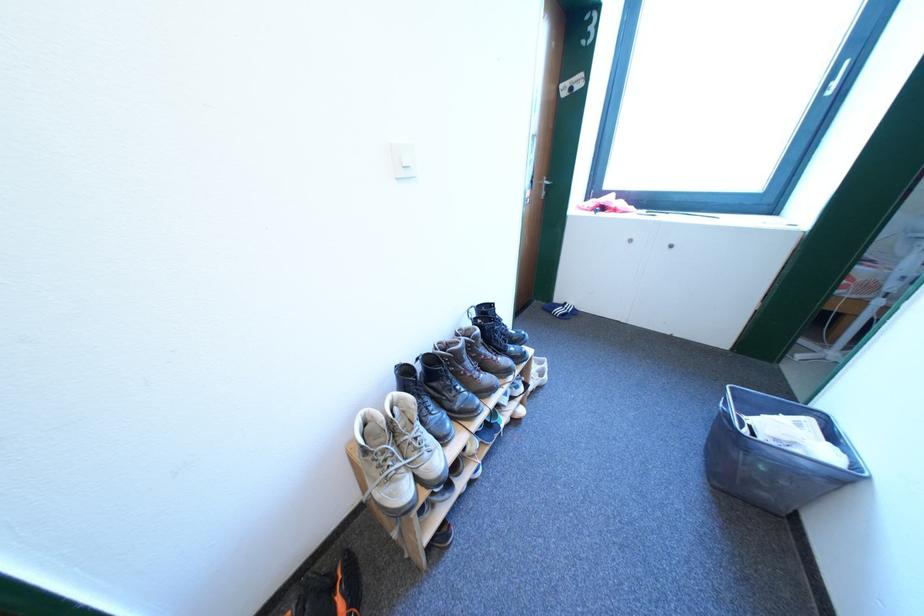
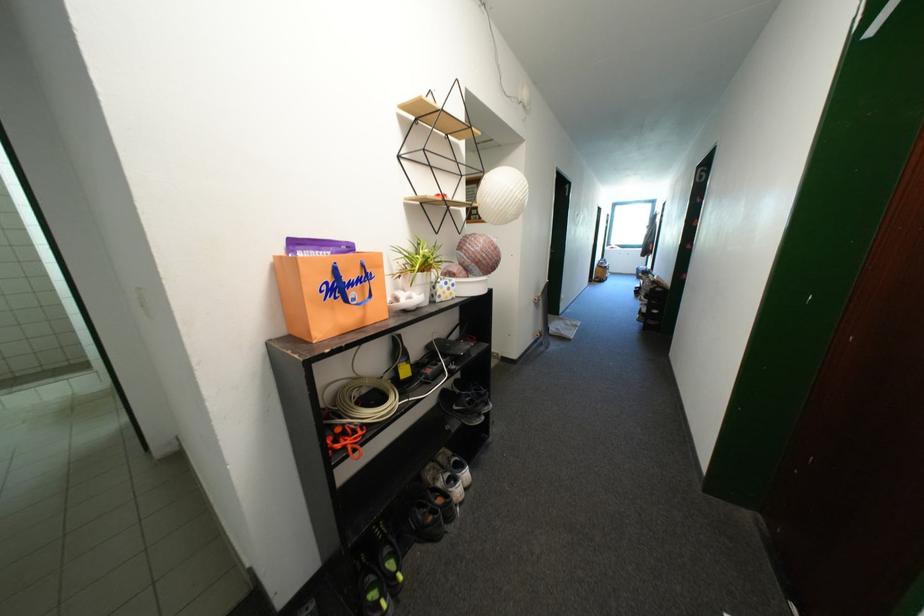
Question: I am providing you with two images of the same scene from different viewpoints. Which of the following objects are not visible in image2?

Choices:
 (A) door handle
 (B) polka-dot container
 (C) blue bag handle
 (D) blue baby bath

Answer: (A)